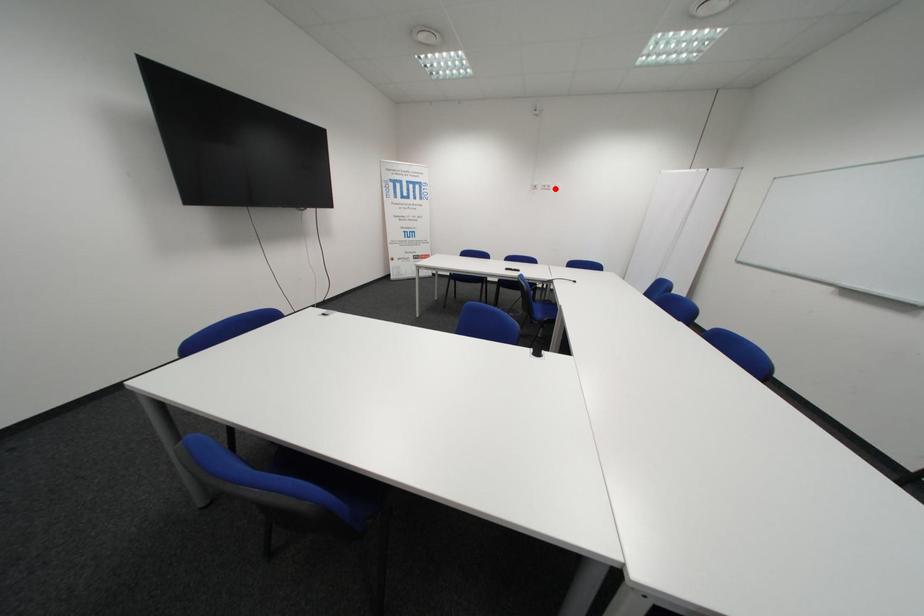
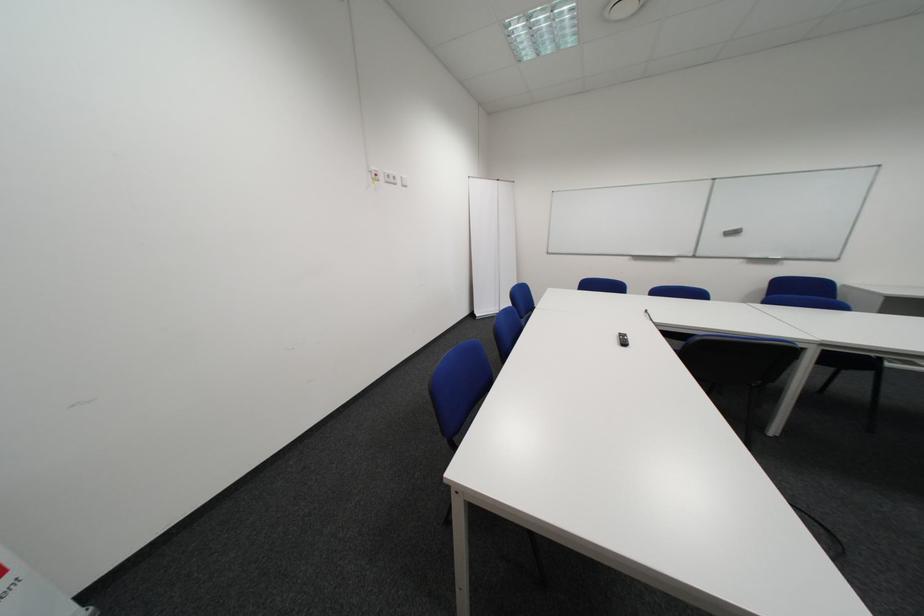
Find the pixel in the second image that matches the highlighted location in the first image.

(398, 180)